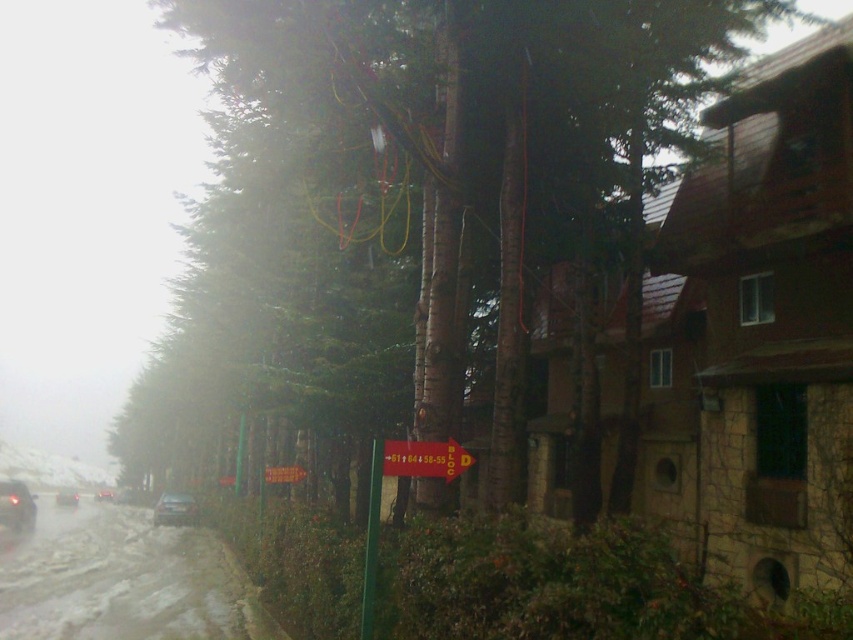
You are driving a car and see the yellow matte sign at center and the shiny silver car at lower left. According to the scene, which object is closer to the right edge of the image?

The yellow matte sign at center is closer to the right edge of the image because it is positioned to the right of the shiny silver car at lower left.

You are driving a car and see the shiny black car at lower left and the brown textured tree at center in your view. Which object is closer to the right side of the road?

The brown textured tree at center is to the right of the shiny black car at lower left, so the brown textured tree at center is closer to the right side of the road.

You are driving a car and see the image. There is a yellow matte sign at center and a shiny silver car at lower left. Which object is higher in the image?

The yellow matte sign at center is positioned over the shiny silver car at lower left, so it is higher in the image.